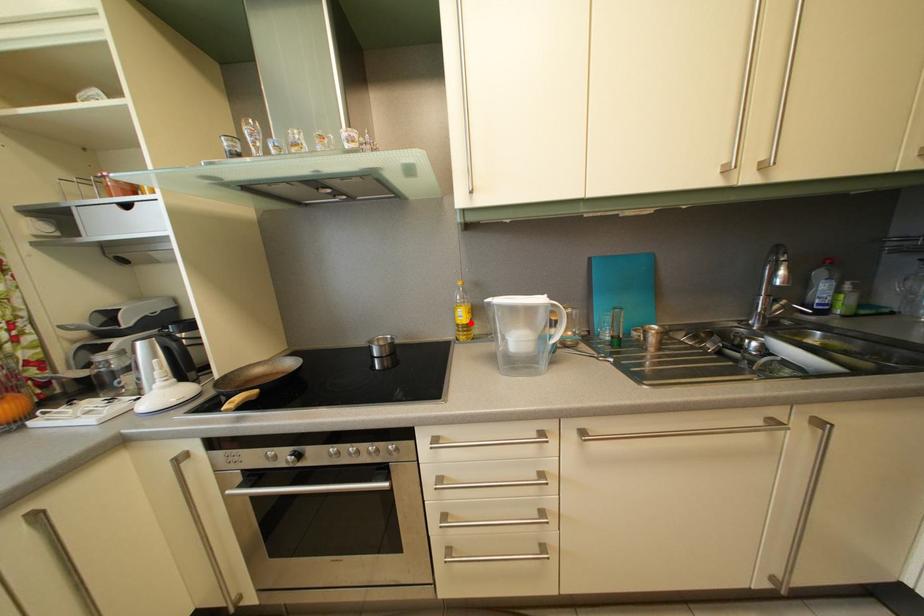
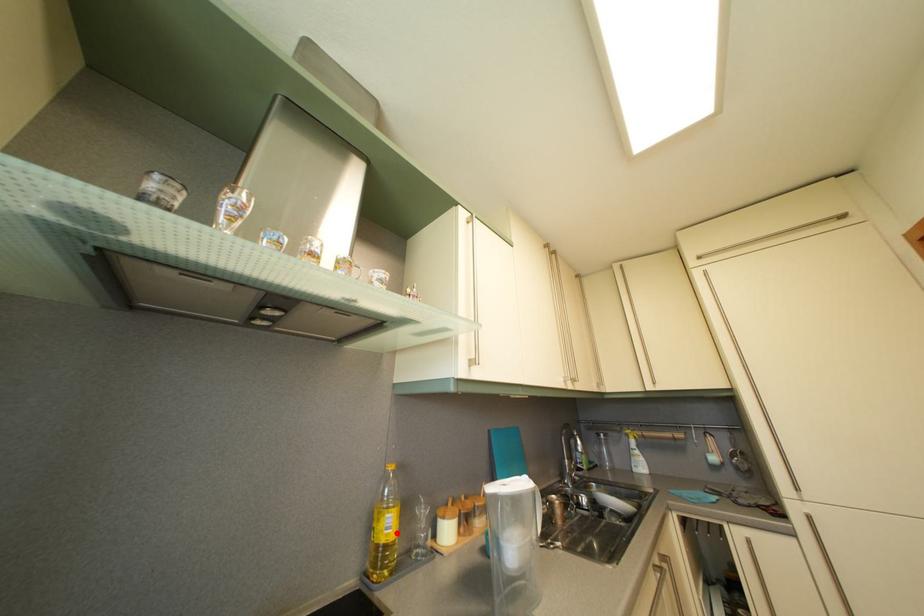
I am providing you with two images of the same scene from different viewpoints. A red point is marked on the first image and another point is marked on the second image. Do the highlighted points in image1 and image2 indicate the same real-world spot?

Yes